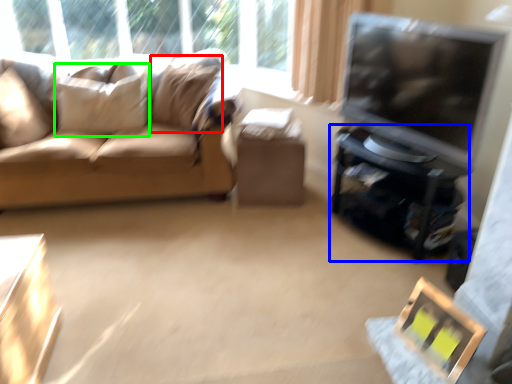
Question: Which is nearer to the pillow (highlighted by a red box)? entertainment center (highlighted by a blue box) or pillow (highlighted by a green box).

Choices:
 (A) entertainment center
 (B) pillow

Answer: (B)